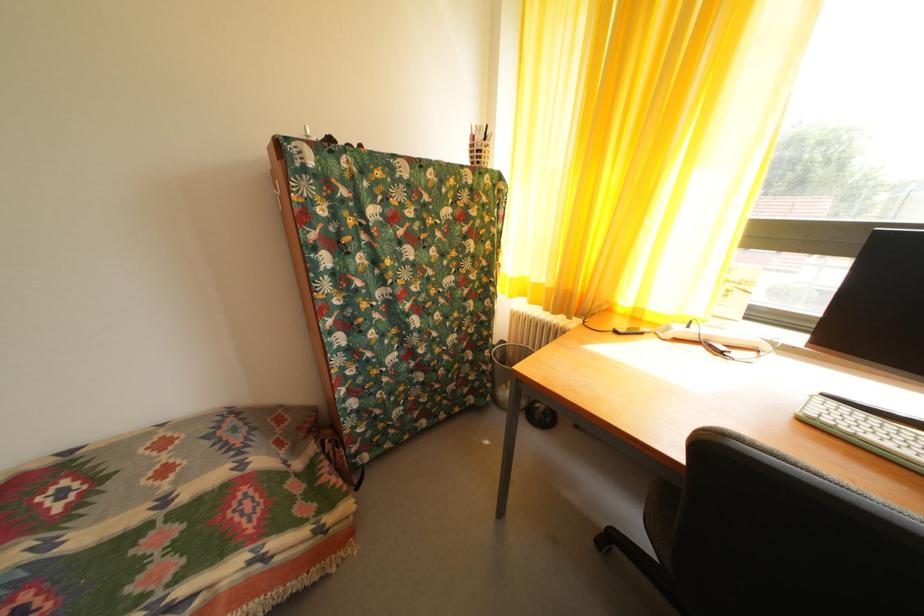
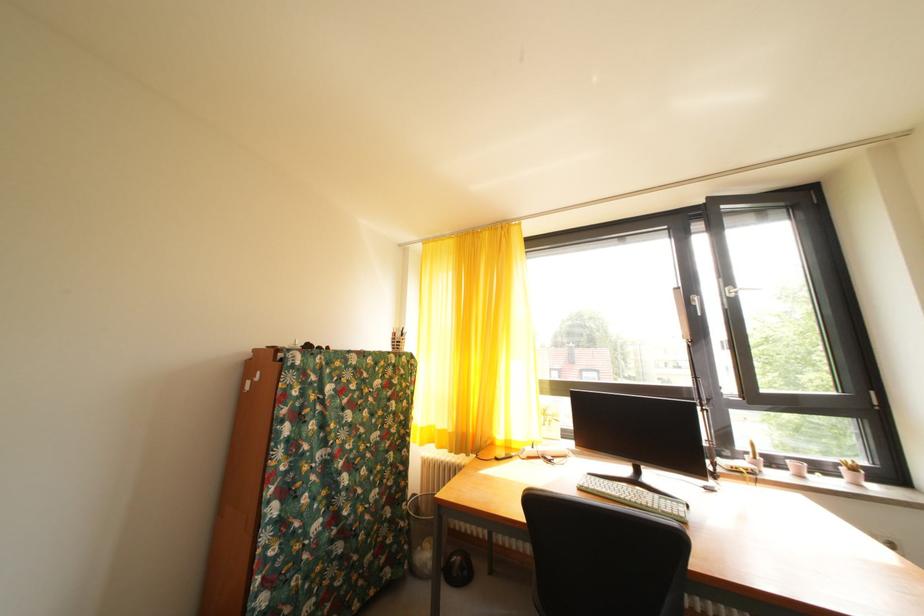
Based on the continuous images, in which direction is the camera rotating?

The camera's rotation is toward right-up.